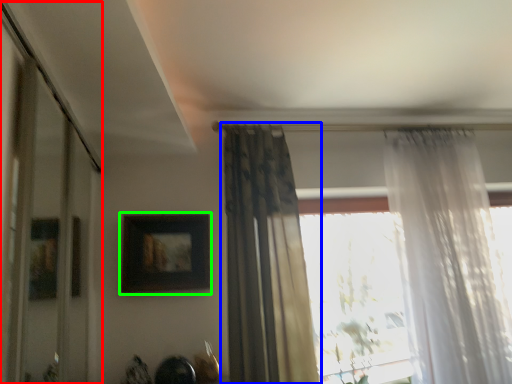
Question: Which object is positioned farthest from glass door (highlighted by a red box)? Select from curtain (highlighted by a blue box) and picture frame (highlighted by a green box).

Choices:
 (A) curtain
 (B) picture frame

Answer: (A)